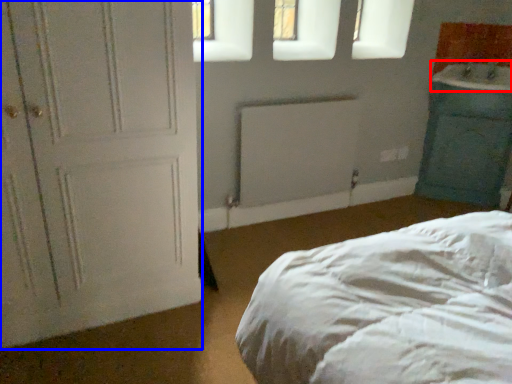
Question: Among these objects, which one is farthest to the camera, sink (highlighted by a red box) or door (highlighted by a blue box)?

Choices:
 (A) sink
 (B) door

Answer: (A)